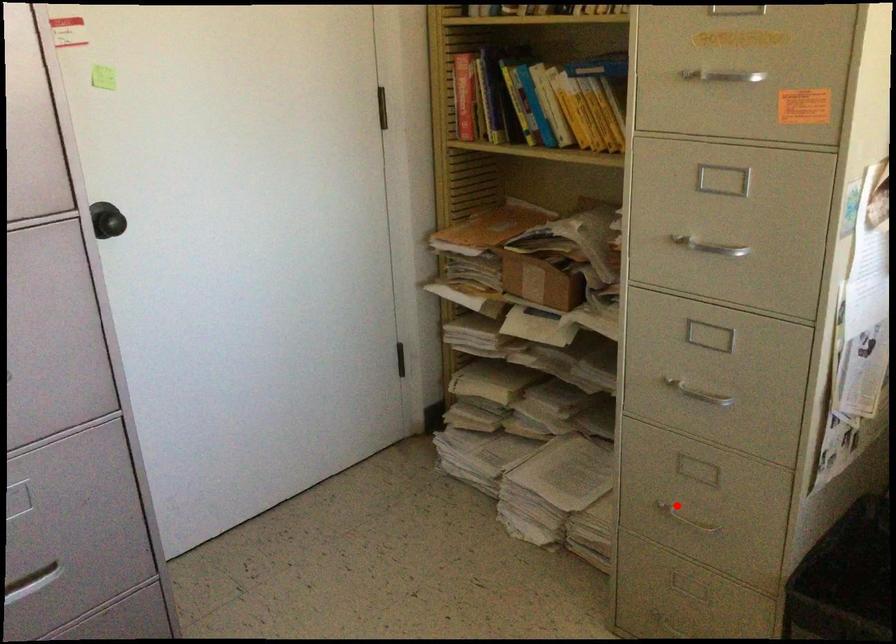
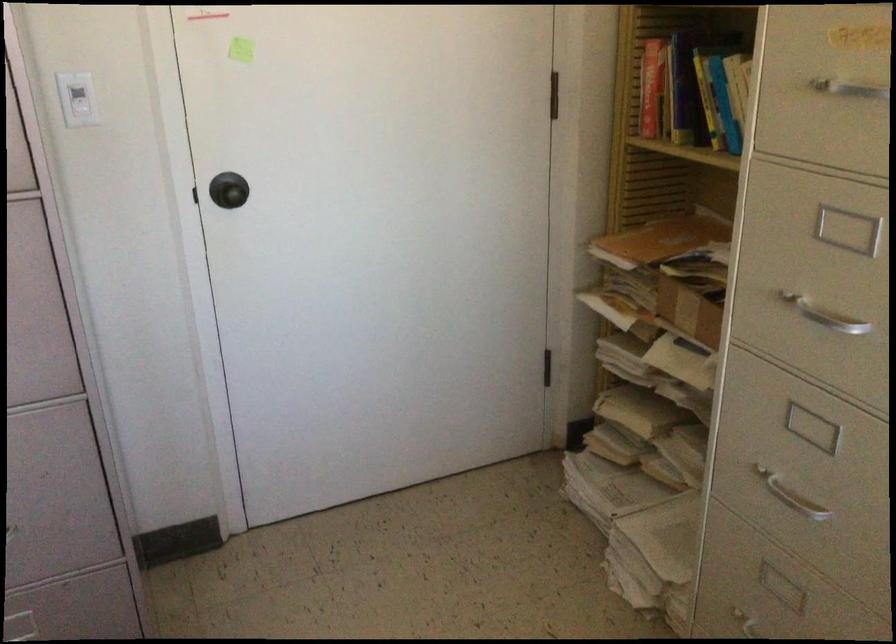
Where in the second image is the point corresponding to the highlighted location from the first image?

(754, 625)